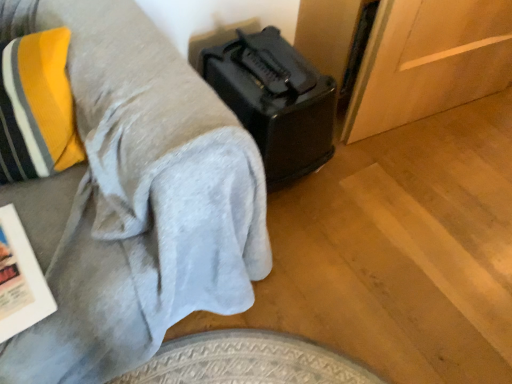
Question: Does black plastic suitcase at lower right contain white paper magazine at lower left?

Choices:
 (A) yes
 (B) no

Answer: (B)

Question: Does black plastic suitcase at lower right have a larger size compared to white paper magazine at lower left?

Choices:
 (A) no
 (B) yes

Answer: (B)

Question: Is black plastic suitcase at lower right wider than white paper magazine at lower left?

Choices:
 (A) yes
 (B) no

Answer: (A)

Question: Is the depth of black plastic suitcase at lower right less than that of white paper magazine at lower left?

Choices:
 (A) no
 (B) yes

Answer: (A)

Question: Does black plastic suitcase at lower right have a lesser height compared to white paper magazine at lower left?

Choices:
 (A) no
 (B) yes

Answer: (A)

Question: Can you see black plastic suitcase at lower right touching white paper magazine at lower left?

Choices:
 (A) yes
 (B) no

Answer: (B)

Question: Is white paper magazine at lower left taller than black plastic toaster at upper right?

Choices:
 (A) no
 (B) yes

Answer: (A)

Question: Is white paper magazine at lower left shorter than black plastic toaster at upper right?

Choices:
 (A) yes
 (B) no

Answer: (A)

Question: Is white paper magazine at lower left thinner than black plastic toaster at upper right?

Choices:
 (A) no
 (B) yes

Answer: (B)

Question: From a real-world perspective, is white paper magazine at lower left below black plastic toaster at upper right?

Choices:
 (A) no
 (B) yes

Answer: (A)

Question: Is white paper magazine at lower left further to the viewer compared to black plastic toaster at upper right?

Choices:
 (A) yes
 (B) no

Answer: (A)

Question: From a real-world perspective, is white paper magazine at lower left on top of black plastic toaster at upper right?

Choices:
 (A) no
 (B) yes

Answer: (B)

Question: Is white paper magazine at lower left at the back of black plastic toaster at upper right?

Choices:
 (A) no
 (B) yes

Answer: (A)